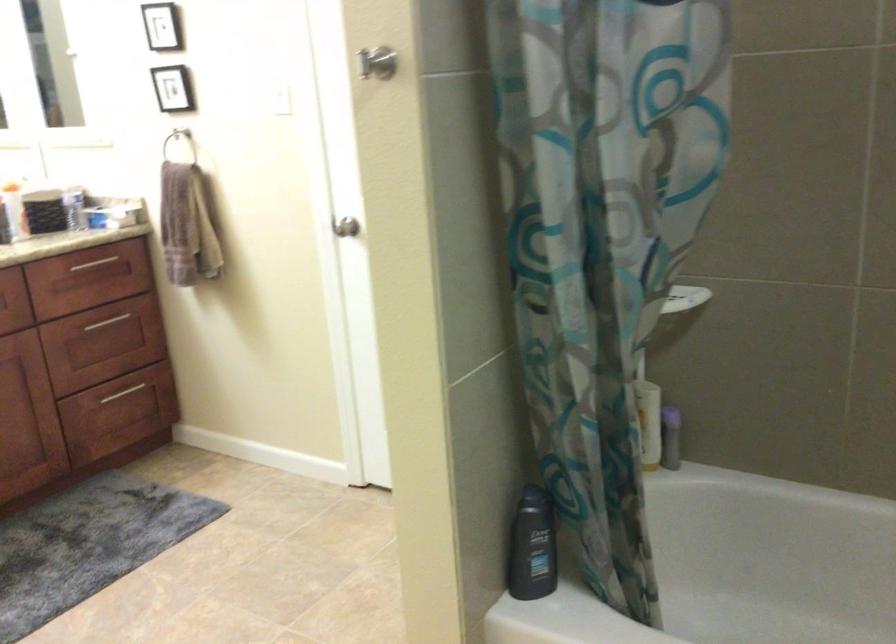
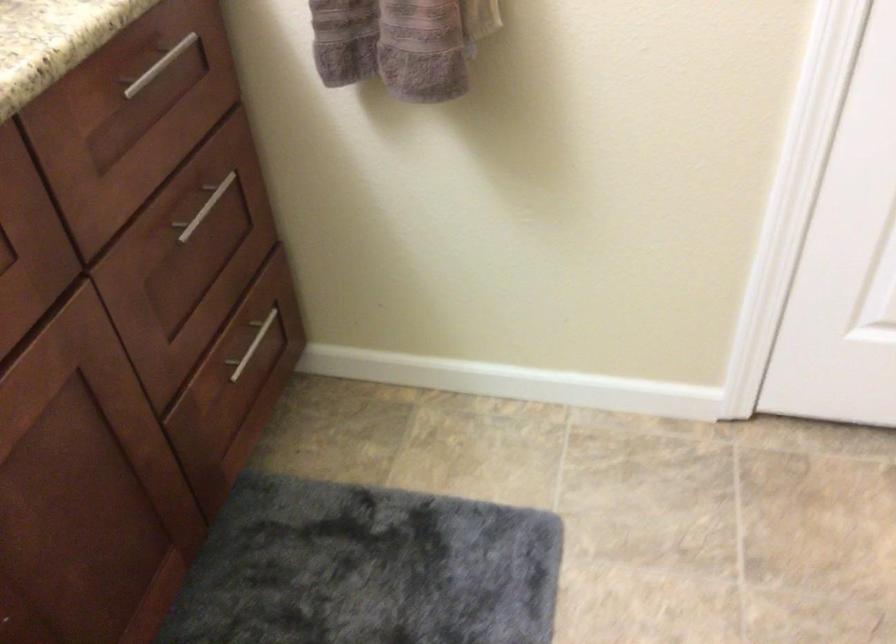
The point at (126,390) is marked in the first image. Where is the corresponding point in the second image?

(252, 345)